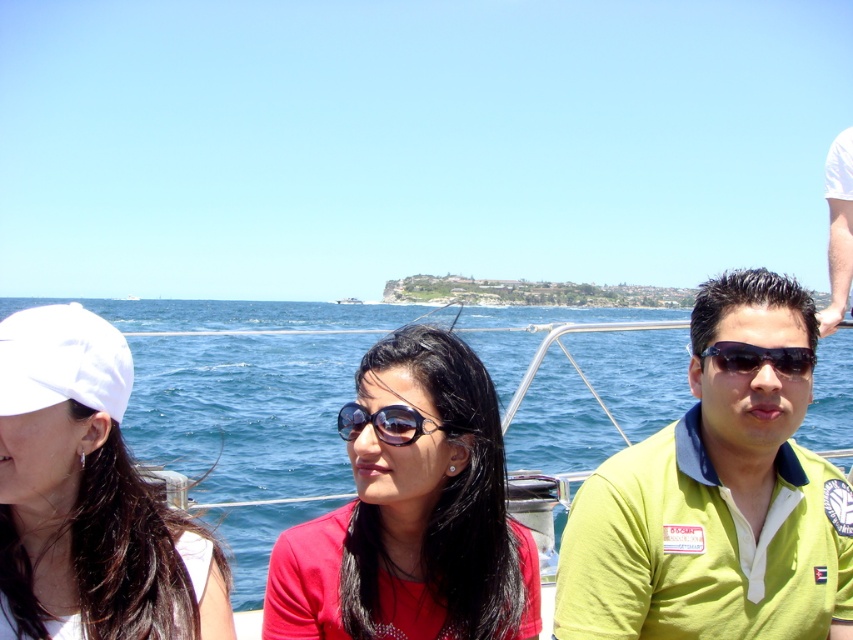
Question: Estimate the real-world distances between objects in this image. Which object is closer to the matte black sunglasses at center?

Choices:
 (A) black plastic sunglasses at center
 (B) white fabric cap at left
 (C) blue water at center

Answer: (A)

Question: Which object appears closest to the camera in this image?

Choices:
 (A) matte black sunglasses at center
 (B) black plastic sunglasses at center
 (C) green polo shirt at right
 (D) sunglasses at center

Answer: (A)

Question: Can you confirm if blue water at center is positioned above white fabric arm at upper right?

Choices:
 (A) yes
 (B) no

Answer: (B)

Question: In this image, where is green polo shirt at right located relative to white fabric arm at upper right?

Choices:
 (A) right
 (B) left

Answer: (B)

Question: Which of the following is the closest to the observer?

Choices:
 (A) white fabric arm at upper right
 (B) green polo shirt at right
 (C) white fabric cap at left
 (D) black plastic sunglasses at center

Answer: (C)

Question: Can you confirm if green polo shirt at right is bigger than black plastic sunglasses at center?

Choices:
 (A) yes
 (B) no

Answer: (A)